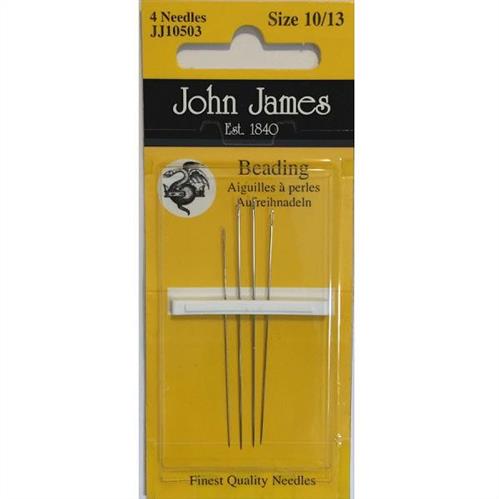
The width and height of the screenshot is (499, 499). Identify the location of beading. (243, 168).